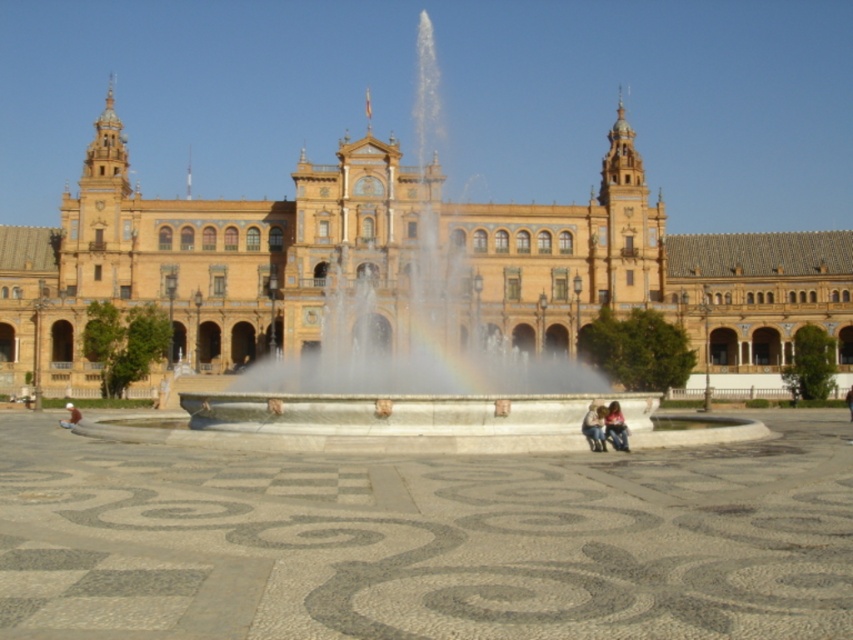
You are a photographer trying to capture both the denim jeans at center and the light brown leather jacket at lower left in the same frame. Given that your camera has a 50mm lens, which has a field of view of approximately 46 degrees, can you estimate if both objects will fit in the frame without moving the camera? Explain your reasoning.

The denim jeans at center and the light brown leather jacket at lower left are 44.94 meters apart. With a 50mm lens having a 46 degree field of view, the maximum distance between two objects that can fit in the frame would depend on the camera sensor size and distance from the camera. However, given the significant distance between the objects and typical camera specifications, it is unlikely that both will fit in the same frame without moving the camera.

You are a photographer wanting to capture the grand building with the fountain in the background. You have two items in your bag, the denim jeans at center and the light brown leather jacket at lower left. Which item should you use to block the sunlight if you need a thinner object?

The denim jeans at center is thinner than the light brown leather jacket at lower left, so you should use the denim jeans at center to block the sunlight since it is thinner.